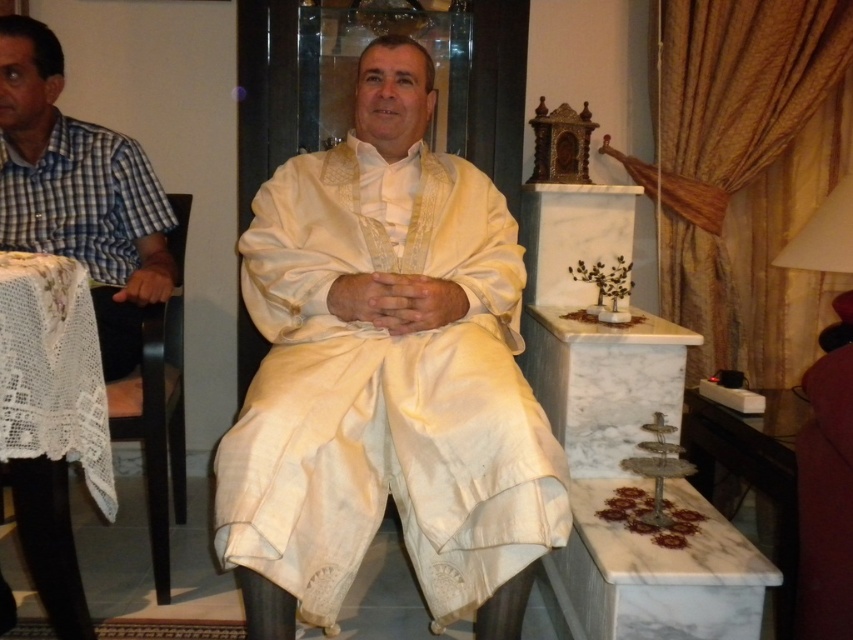
Can you confirm if white silk robe at center is positioned above black wood chair at left?

Yes.

Which is more to the left, white silk robe at center or black wood chair at left?

black wood chair at left is more to the left.

Based on the photo, who is more forward, (426,92) or (115,401)?

Point (115,401)

At what (x,y) coordinates should I click in order to perform the action: click on white silk robe at center. Please return your answer as a coordinate pair (x, y). The height and width of the screenshot is (640, 853). Looking at the image, I should click on (x=386, y=376).

Can you confirm if white silk robe at center is smaller than crocheted lace tablecloth at left?

No.

Is point (508, 502) less distant than point (91, 403)?

That is True.

Identify the location of white silk robe at center. The height and width of the screenshot is (640, 853). (386, 376).

Does black wood chair at left come in front of crocheted lace tablecloth at left?

No, it is not.

I want to click on black wood chair at left, so click(155, 422).